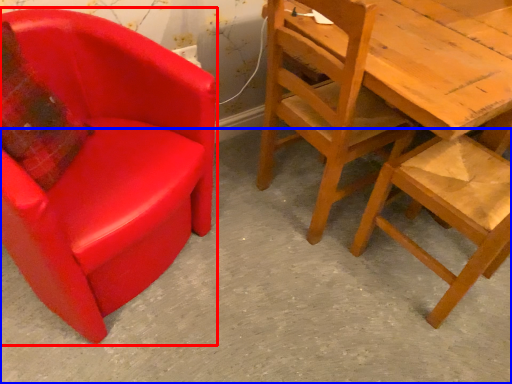
Question: Which object is closer to the camera taking this photo, chair (highlighted by a red box) or concrete (highlighted by a blue box)?

Choices:
 (A) chair
 (B) concrete

Answer: (A)